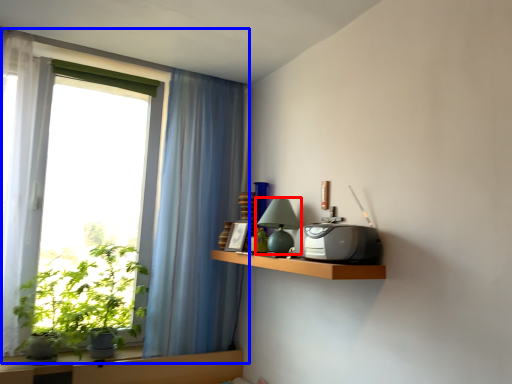
Question: Which object appears farthest to the camera in this image, table lamp (highlighted by a red box) or window (highlighted by a blue box)?

Choices:
 (A) table lamp
 (B) window

Answer: (B)